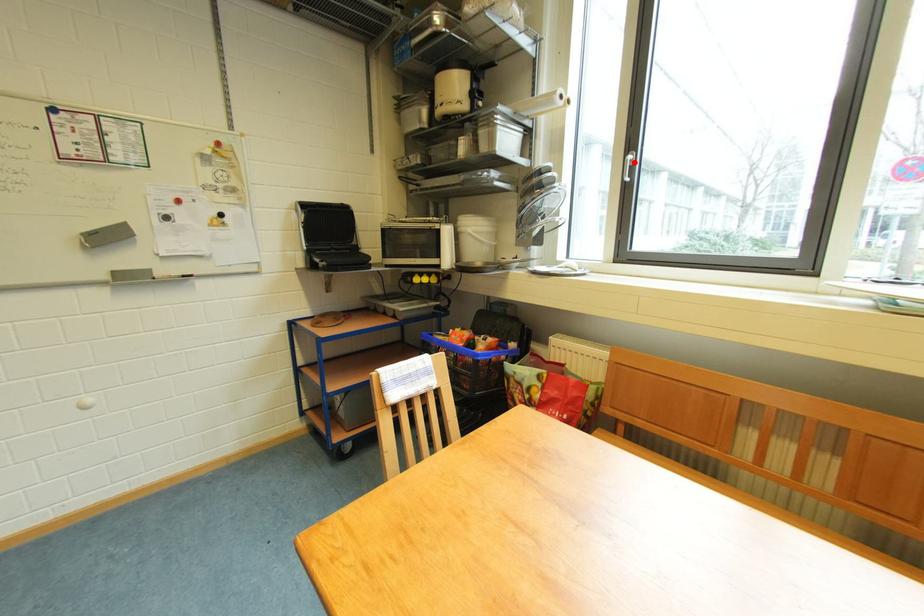
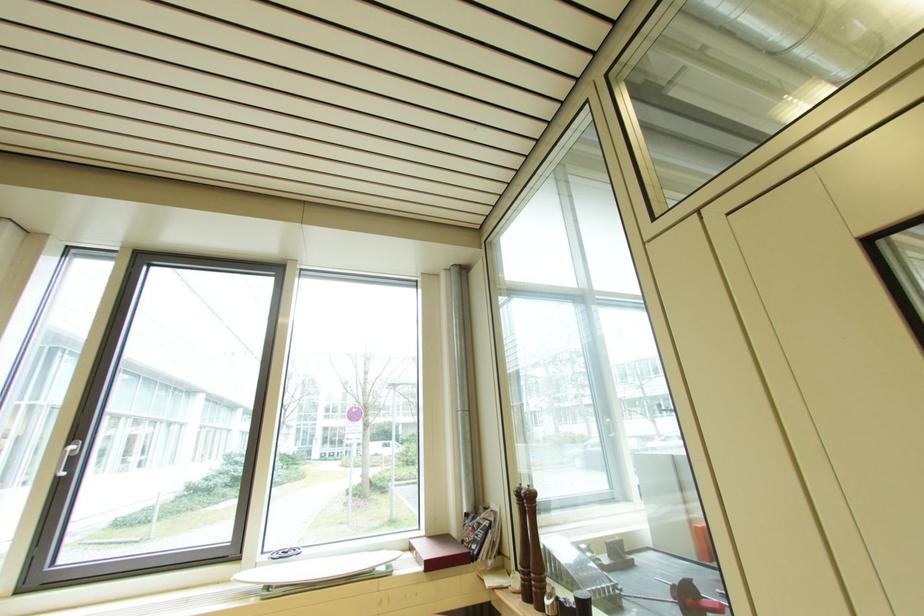
Where in the second image is the point corresponding to the highlighted location from the first image?

(73, 455)